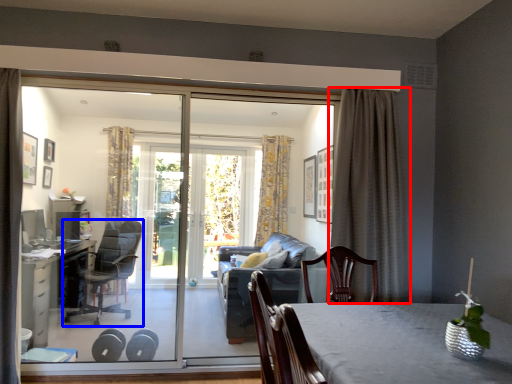
Question: Among these objects, which one is nearest to the camera, curtain (highlighted by a red box) or chair (highlighted by a blue box)?

Choices:
 (A) curtain
 (B) chair

Answer: (A)